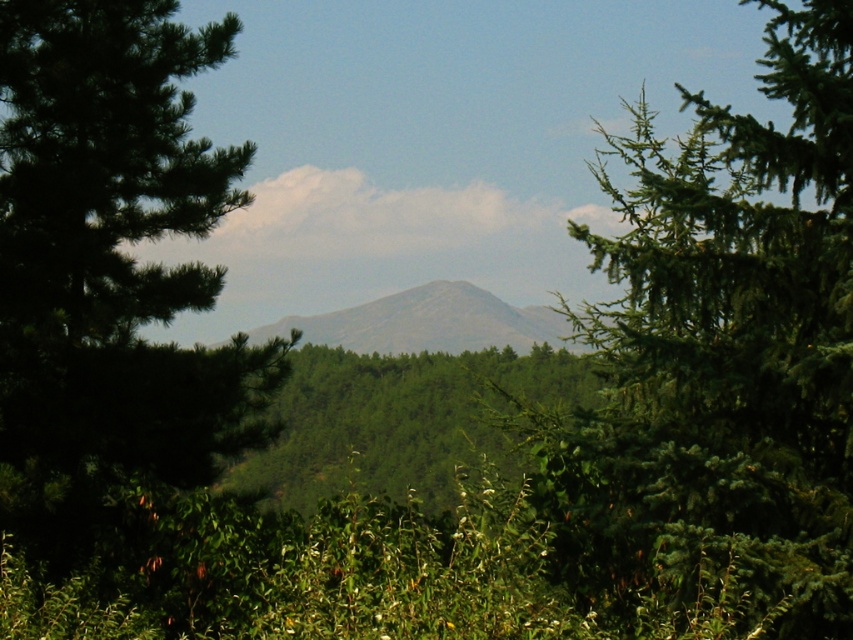
Question: Which point is closer to the camera?

Choices:
 (A) green matte tree at left
 (B) green needle-like at right

Answer: (B)

Question: Considering the relative positions of green needle-like at right and green matte tree at left in the image provided, where is green needle-like at right located with respect to green matte tree at left?

Choices:
 (A) left
 (B) right

Answer: (B)

Question: Can you confirm if green needle-like at right is thinner than green matte tree at left?

Choices:
 (A) no
 (B) yes

Answer: (A)

Question: Which object appears farthest from the camera in this image?

Choices:
 (A) green needle-like at right
 (B) green matte tree at left

Answer: (B)

Question: Which point is farther from the camera taking this photo?

Choices:
 (A) (254, 406)
 (B) (849, 413)

Answer: (A)

Question: From the image, what is the correct spatial relationship of green needle-like at right in relation to green matte tree at left?

Choices:
 (A) left
 (B) right

Answer: (B)